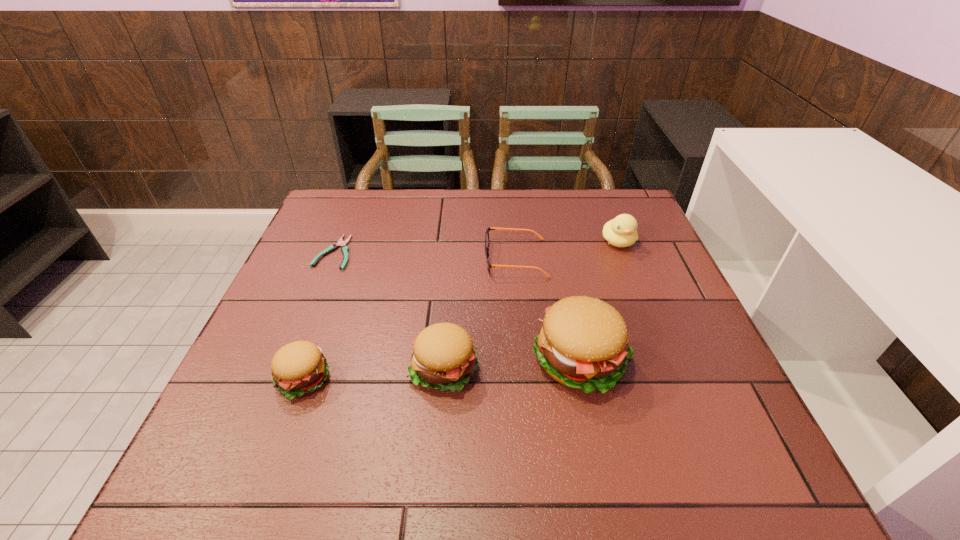
Identify the location of free area in between the second shortest object and the leftmost hamburger. The height and width of the screenshot is (540, 960). (408, 319).

Locate an element on the screen. free space between the duckling and the third shortest object is located at coordinates (460, 310).

Find the location of a particular element. The width and height of the screenshot is (960, 540). free space between the duckling and the second tallest hamburger is located at coordinates (531, 305).

This screenshot has width=960, height=540. I want to click on vacant area between the third shortest object and the rightmost object, so click(x=460, y=310).

Where is `vacant space in between the shortest object and the third shortest object`? This screenshot has width=960, height=540. vacant space in between the shortest object and the third shortest object is located at coordinates (318, 315).

Identify the location of vacant space that's between the pliers and the rightmost object. The image size is (960, 540). (476, 247).

The width and height of the screenshot is (960, 540). What are the coordinates of `free space between the second shortest object and the pliers` in the screenshot? It's located at (425, 255).

Find the location of a particular element. The height and width of the screenshot is (540, 960). object that stands as the fifth closest to the fourth object from right to left is located at coordinates (621, 231).

Select which object appears as the second closest to the shortest object. Please provide its 2D coordinates. Your answer should be formatted as a tuple, i.e. [(x, y)], where the tuple contains the x and y coordinates of a point satisfying the conditions above.

[(443, 357)]

Locate which hamburger ranks third in proximity to the shortest object. Please provide its 2D coordinates. Your answer should be formatted as a tuple, i.e. [(x, y)], where the tuple contains the x and y coordinates of a point satisfying the conditions above.

[(583, 344)]